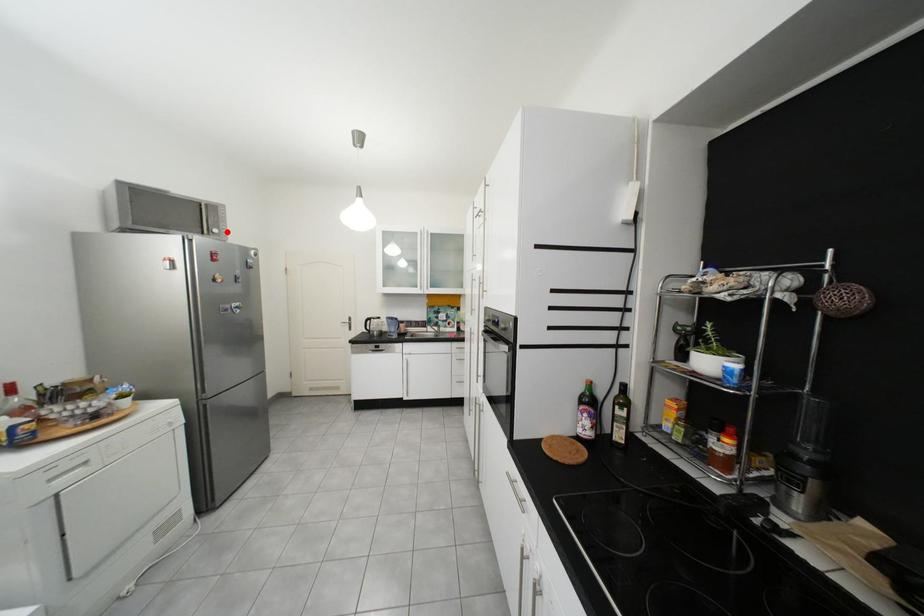
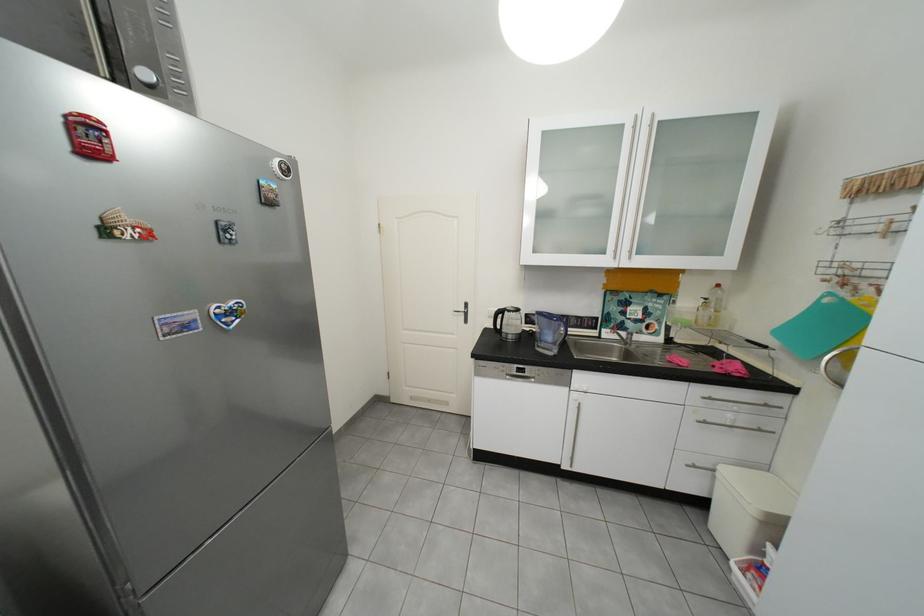
The point at the highlighted location is marked in the first image. Where is the corresponding point in the second image?

(156, 75)